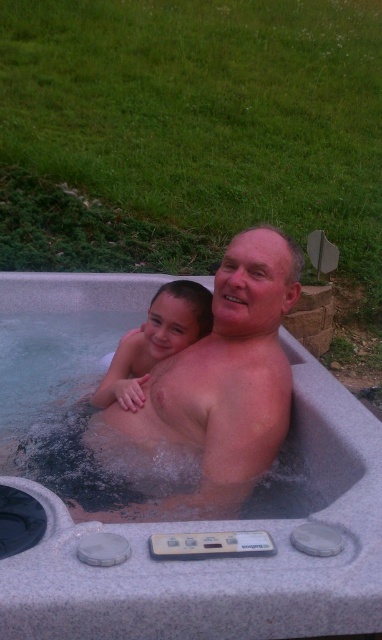
You are standing in front of the hot tub and want to place a floating toy at the point closer to you. Which point should you choose between point (186,403) and point (174,316)?

Point (186,403) is closer to the camera, so you should choose point (186,403) to place the floating toy.

You are a lifeguard at a community pool and need to ensure safety. The gray plastic hot tub at center and the smooth skin man at center are in your area of responsibility. Based on their sizes, which one is shorter?

The gray plastic hot tub at center is shorter than the smooth skin man at center.

You are a photographer standing behind the gray plastic hot tub at center and want to take a photo of the smooth skin child at center. Which direction should you move to get the child in the frame?

The gray plastic hot tub at center is to the right of the smooth skin child at center, so you should move to the left to position yourself closer to the child and capture them in the photo.